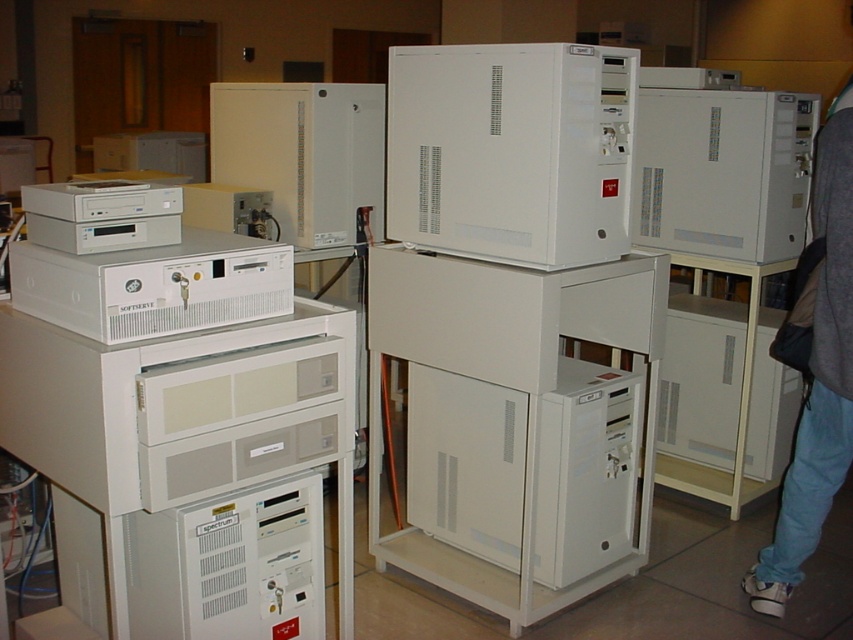
Question: Which object is closer to the camera taking this photo?

Choices:
 (A) white matte computer tower at center
 (B) white plastic server at center

Answer: (A)

Question: Which point is farther from the camera taking this photo?

Choices:
 (A) (426, 369)
 (B) (347, 193)
 (C) (793, 486)
 (D) (144, 272)

Answer: (B)

Question: Observing the image, what is the correct spatial positioning of white matte computer tower at center in reference to white matte computer at center?

Choices:
 (A) below
 (B) above

Answer: (B)

Question: Can you confirm if white plastic cabinet at upper center is positioned below jeans at lower right?

Choices:
 (A) yes
 (B) no

Answer: (B)

Question: Can you confirm if white matte computer tower at center-right is smaller than white plastic cabinet at upper center?

Choices:
 (A) yes
 (B) no

Answer: (A)

Question: Which object appears farthest from the camera in this image?

Choices:
 (A) white matte computer tower at center-right
 (B) white plastic cabinet at upper center
 (C) white matte computer at center

Answer: (A)